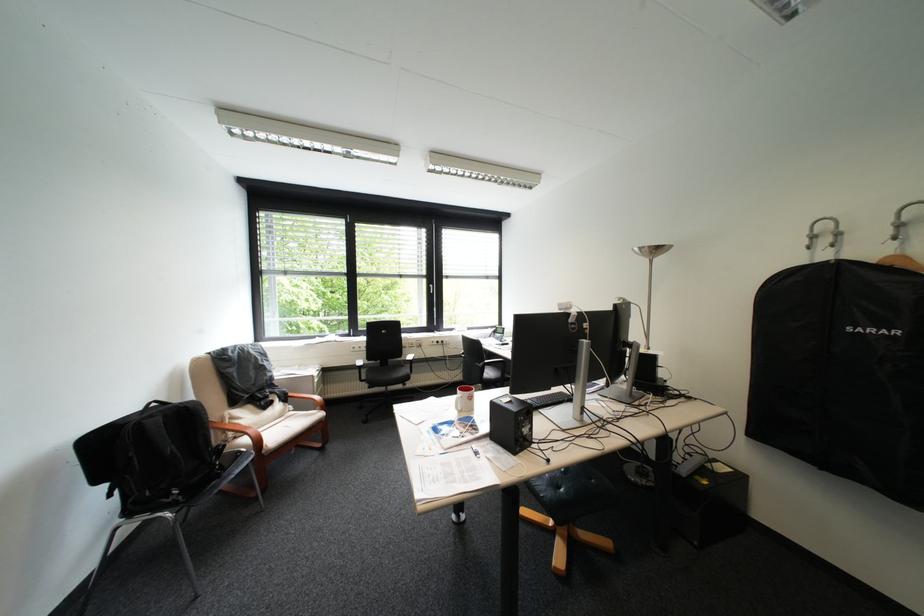
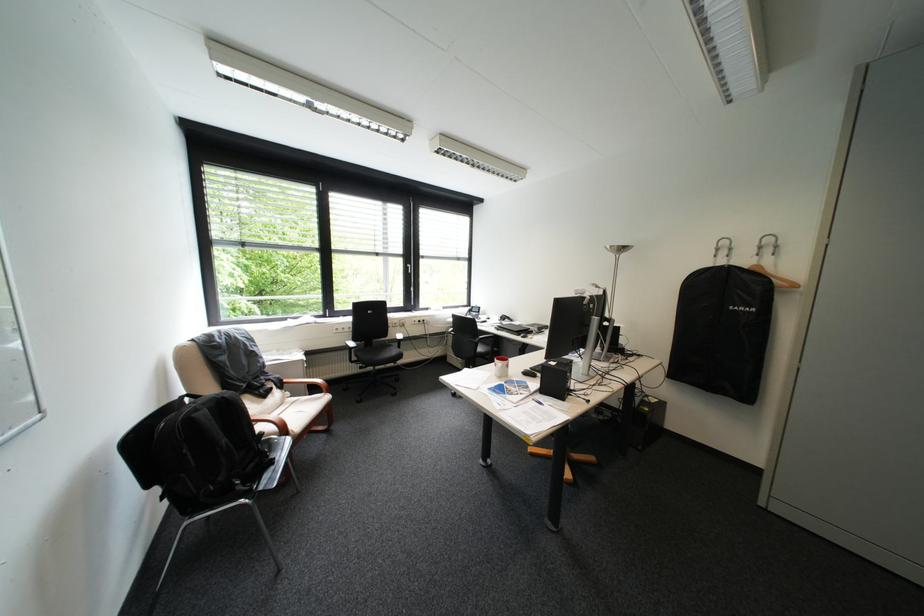
Where in the second image is the point corresponding to point 820,233 from the first image?

(727, 246)